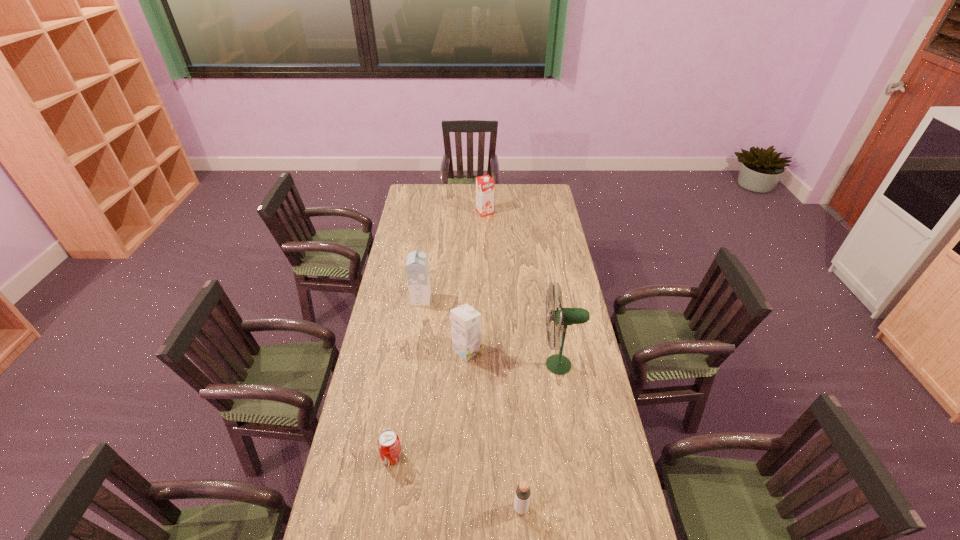
What are the coordinates of `blank area located on the front-facing side of the rightmost object` in the screenshot? It's located at (462, 364).

Identify the location of free spot located on the front-facing side of the rightmost object. This screenshot has height=540, width=960. (487, 364).

The width and height of the screenshot is (960, 540). Find the location of `vacant space located on the front-facing side of the rightmost object`. vacant space located on the front-facing side of the rightmost object is located at coordinates (477, 364).

Where is `vacant space situated on the front label of the second farthest carton`? vacant space situated on the front label of the second farthest carton is located at coordinates (462, 299).

The image size is (960, 540). I want to click on vacant space located on the right of the farthest carton, so click(x=520, y=213).

The height and width of the screenshot is (540, 960). In order to click on free location located 0.350m on the back of the nearest carton in this screenshot , I will do `click(468, 285)`.

Locate an element on the screen. The height and width of the screenshot is (540, 960). vacant space located 0.060m on the back of the second object from right to left is located at coordinates (519, 482).

Where is `vacant space located 0.100m on the right of the soda`? Image resolution: width=960 pixels, height=540 pixels. vacant space located 0.100m on the right of the soda is located at coordinates (432, 457).

The height and width of the screenshot is (540, 960). In order to click on carton that is positioned at the left edge in this screenshot , I will do `click(417, 269)`.

Find the location of a particular element. The width and height of the screenshot is (960, 540). soda present at the left edge is located at coordinates (388, 442).